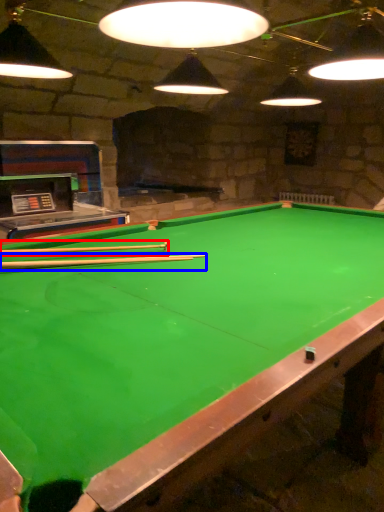
Question: Which object is closer to the camera taking this photo, cue (highlighted by a red box) or cue (highlighted by a blue box)?

Choices:
 (A) cue
 (B) cue

Answer: (B)